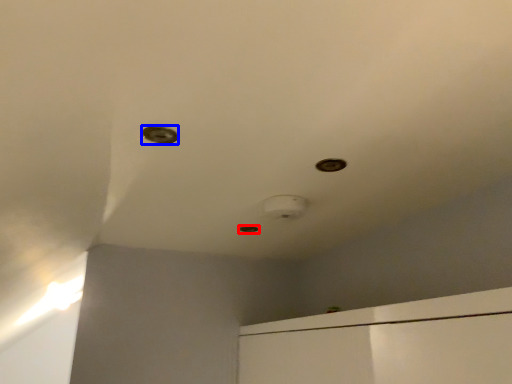
Question: Which of the following is the closest to the observer, hole (highlighted by a red box) or hole (highlighted by a blue box)?

Choices:
 (A) hole
 (B) hole

Answer: (B)